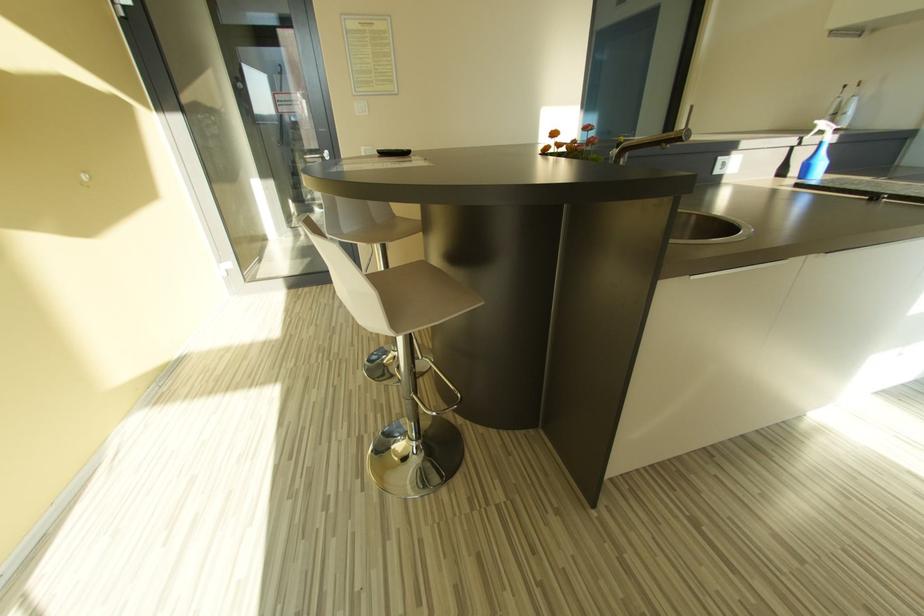
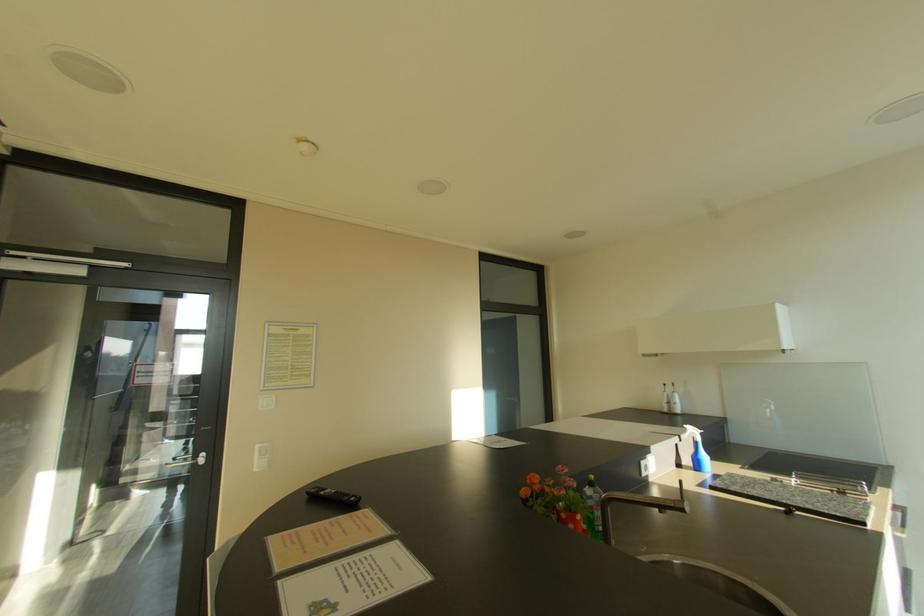
Based on the continuous images, in which direction is the camera rotating?

The camera rotated toward right-up.